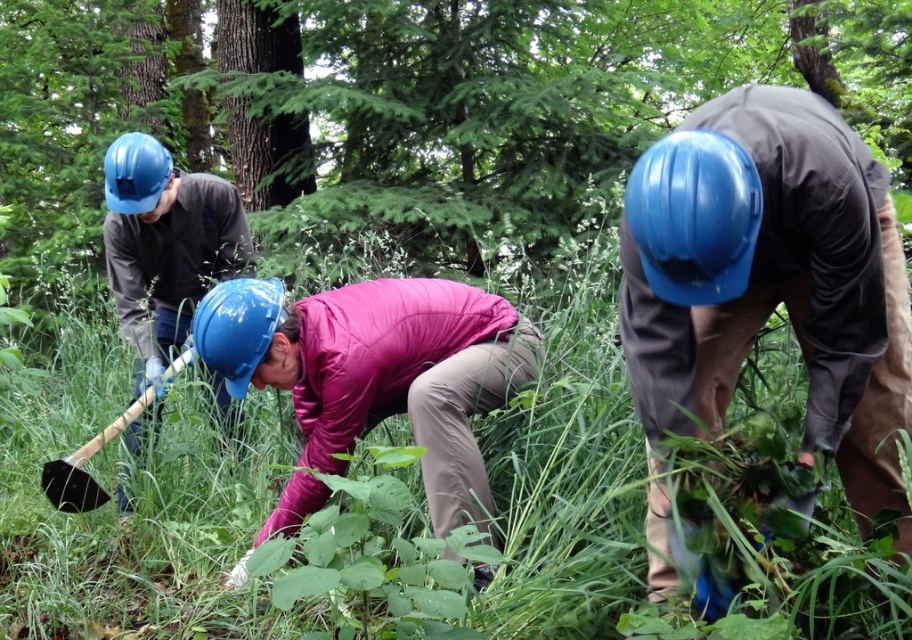
You are standing at the point marked as point (202,323). You want to walk to the nearest person. Which direction should you go?

The nearest person is the woman in the center wearing a vibrant pink jacket and beige pants, so you should walk towards the center of the image.

You are a park ranger assessing the terrain for safety. The green grass at center and the matte blue helmet at left are both in your line of sight. Which object is closer to you?

The green grass at center is closer because it is shorter than the matte blue helmet at left, which is taller and thus further away.

You are a hiker who just arrived at the forest area shown in the image. You need to locate the pink fabric jacket at center and the black plastic shovel at lower left. Based on the scene description, which object is positioned to the right of the other?

The pink fabric jacket at center is to the right of the black plastic shovel at lower left.